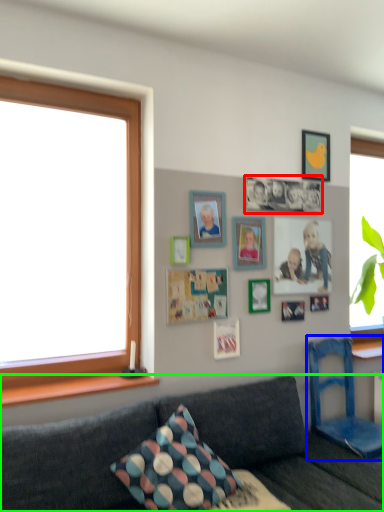
Question: Considering the real-world distances, which object is closest to decorative picture (highlighted by a red box)? armchair (highlighted by a blue box) or studio couch (highlighted by a green box).

Choices:
 (A) armchair
 (B) studio couch

Answer: (A)